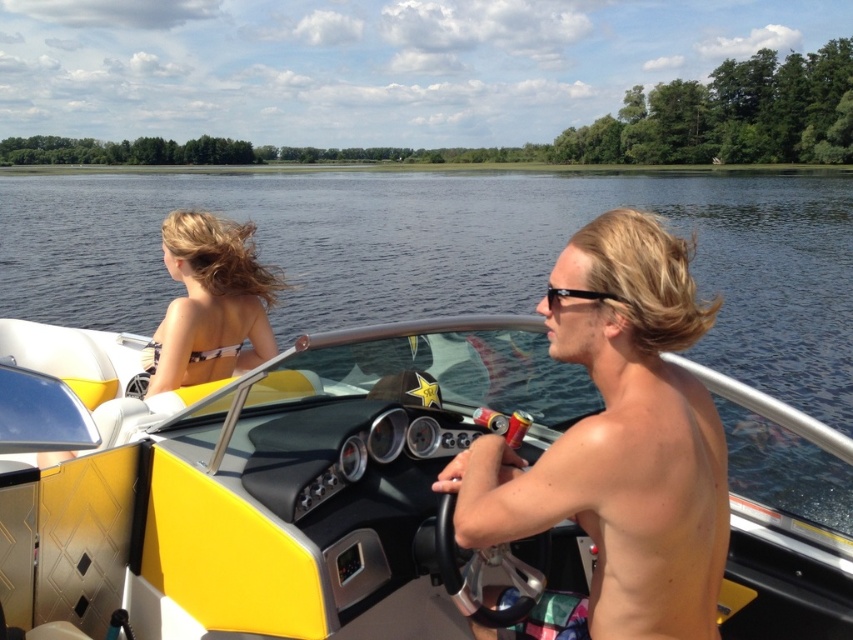
You are standing on the dock and want to throw a lifebuoy to the point at coordinates point (445, 492). The lifebuoy has a diameter of 0.8 meters. Can you estimate if the lifebuoy will reach the point?

The distance between the viewer and the point (445, 492) is 2.14 meters. Since the lifebuoy has a diameter of 0.8 meters, it can travel approximately 0.8 meters when thrown. Therefore, the lifebuoy will not reach the point as the required distance is greater than the throw range.

What object is located at the coordinate point (260, 481) in the image?

The point (260, 481) marks the yellow matte boat at center.

You are a photographer taking a picture of the scene. Which object should you focus on first if you want to capture the black bikini top at left and the black plastic sunglasses at center in the same frame? Explain your reasoning based on their positions.

The black bikini top at left is above the black plastic sunglasses at center, so focusing on the sunglasses first would ensure both objects remain in the frame as the bikini top is positioned higher up.